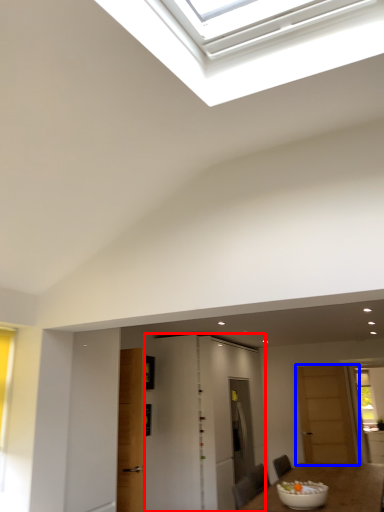
Question: Which object appears farthest to the camera in this image, door (highlighted by a red box) or door (highlighted by a blue box)?

Choices:
 (A) door
 (B) door

Answer: (B)